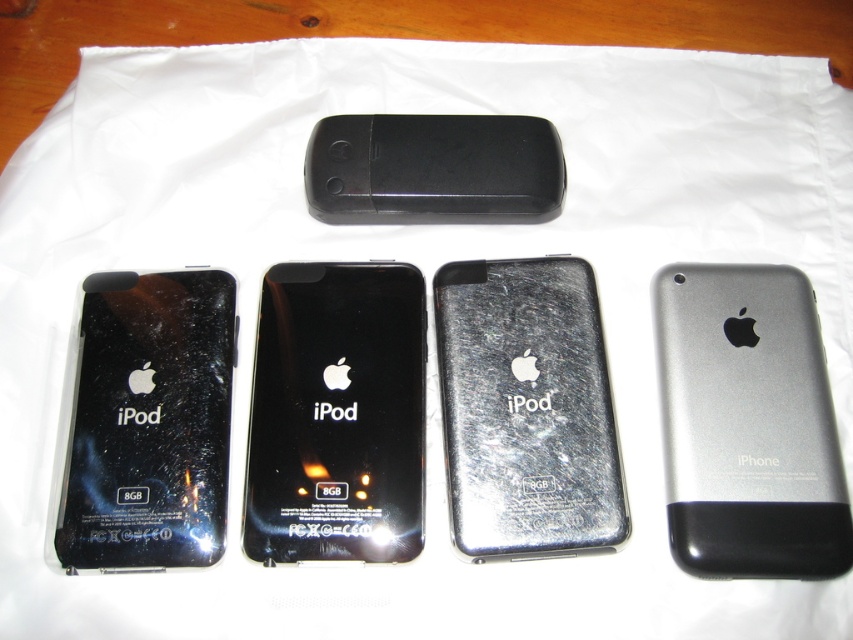
Can you confirm if black glossy ipod at left is wider than metallic silver ipod at center?

No.

Is point (115, 406) more distant than point (486, 545)?

That is True.

What do you see at coordinates (144, 422) in the screenshot?
I see `black glossy ipod at left` at bounding box center [144, 422].

The width and height of the screenshot is (853, 640). What are the coordinates of `black glossy ipod at left` in the screenshot? It's located at (144, 422).

Where is `metallic silver ipod at center`? The image size is (853, 640). metallic silver ipod at center is located at coordinates (526, 410).

Which is behind, point (543, 449) or point (460, 163)?

Point (460, 163)

What are the coordinates of `metallic silver ipod at center` in the screenshot? It's located at (526, 410).

Looking at this image, which of these two, satin silver iphone at upper right or black matte/soft touch phone at center, stands taller?

Standing taller between the two is satin silver iphone at upper right.

Who is lower down, satin silver iphone at upper right or black matte/soft touch phone at center?

Positioned lower is satin silver iphone at upper right.

Between point (660, 355) and point (509, 209), which one is positioned behind?

The point (509, 209) is more distant.

This screenshot has width=853, height=640. Find the location of `satin silver iphone at upper right`. satin silver iphone at upper right is located at coordinates (747, 426).